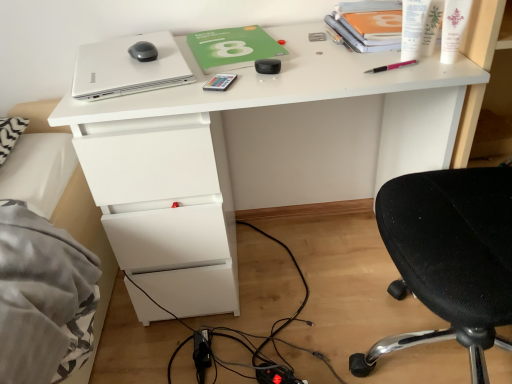
At what (x,y) coordinates should I click in order to perform the action: click on free spot to the right of green matte notebook at center. Please return your answer as a coordinate pair (x, y). The width and height of the screenshot is (512, 384). Looking at the image, I should click on (315, 50).